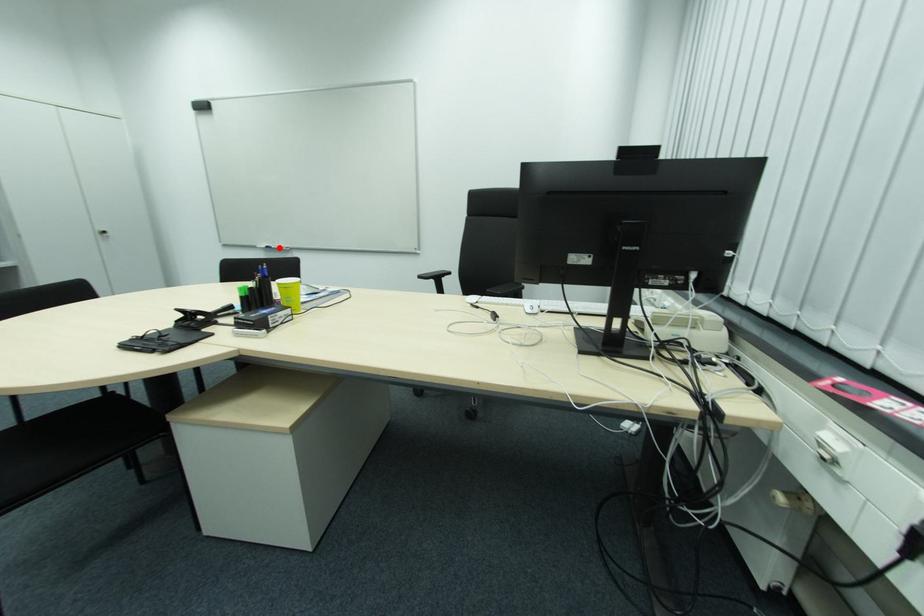
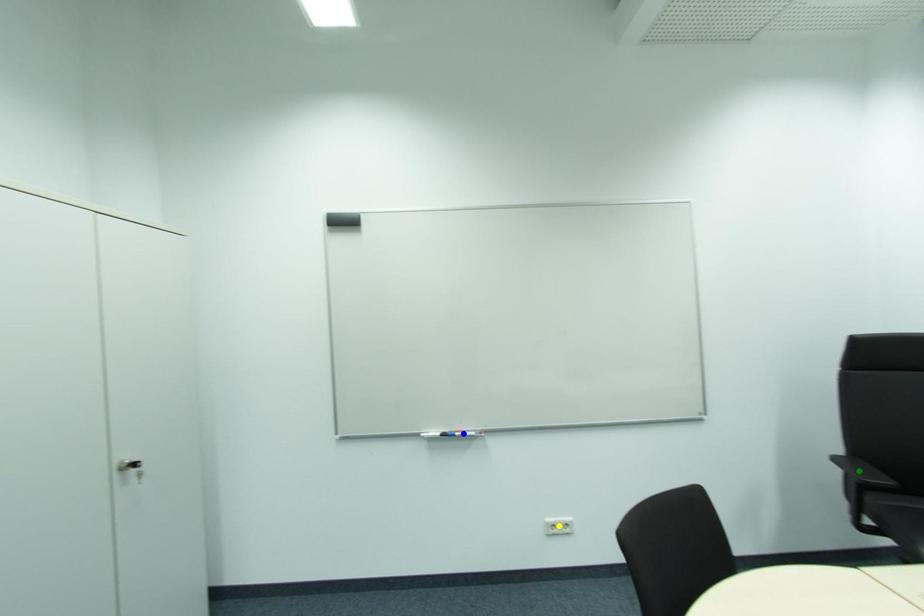
Question: I am providing you with two images of the same scene from different viewpoints. A red point is marked on the first image. You are given multiple points on the second image. Can you choose the point in image 2 that corresponds to the point in image 1?

Choices:
 (A) yellow point
 (B) blue point
 (C) green point

Answer: (B)